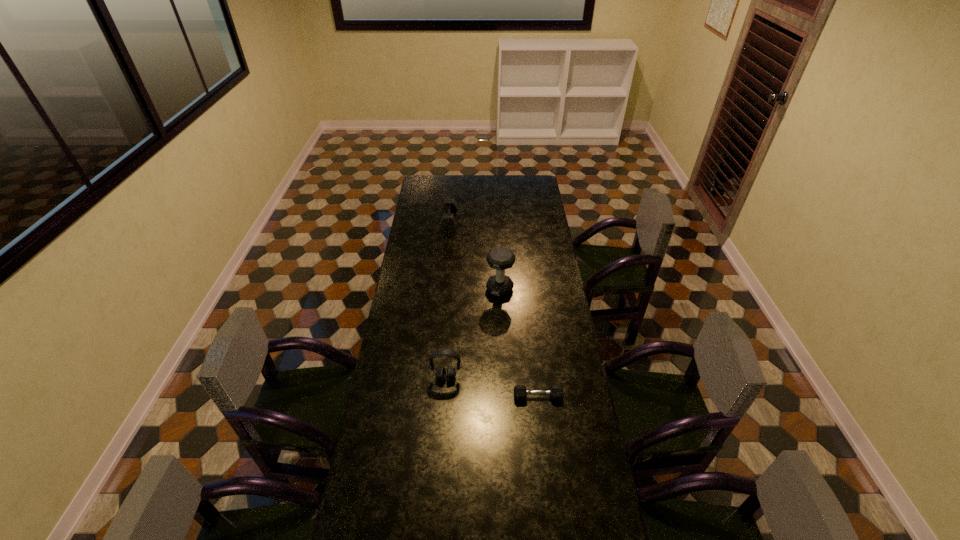
You are a GUI agent. You are given a task and a screenshot of the screen. Output one action in this format:
    pyautogui.click(x=<x>, y=<y>)
    Task: Click on the second closest dumbbell to the farthest dumbbell
    Image resolution: width=960 pixels, height=540 pixels.
    Given the screenshot: What is the action you would take?
    pyautogui.click(x=556, y=392)

The width and height of the screenshot is (960, 540). What are the coordinates of `vacant point that satisfies the following two spatial constraints: 1. on the front-facing side of the shortest dumbbell; 2. on the right side of the headset` in the screenshot? It's located at (445, 396).

The height and width of the screenshot is (540, 960). I want to click on vacant space that satisfies the following two spatial constraints: 1. on the front-facing side of the shortest dumbbell; 2. on the left side of the second tallest object, so click(445, 396).

Where is `vacant space that satisfies the following two spatial constraints: 1. on the front side of the farthest dumbbell; 2. on the right side of the tallest dumbbell`? This screenshot has width=960, height=540. vacant space that satisfies the following two spatial constraints: 1. on the front side of the farthest dumbbell; 2. on the right side of the tallest dumbbell is located at coordinates (443, 289).

At what (x,y) coordinates should I click in order to perform the action: click on free space in the image that satisfies the following two spatial constraints: 1. on the front side of the second farthest object; 2. on the right side of the second tallest dumbbell. Please return your answer as a coordinate pair (x, y). This screenshot has width=960, height=540. Looking at the image, I should click on (443, 289).